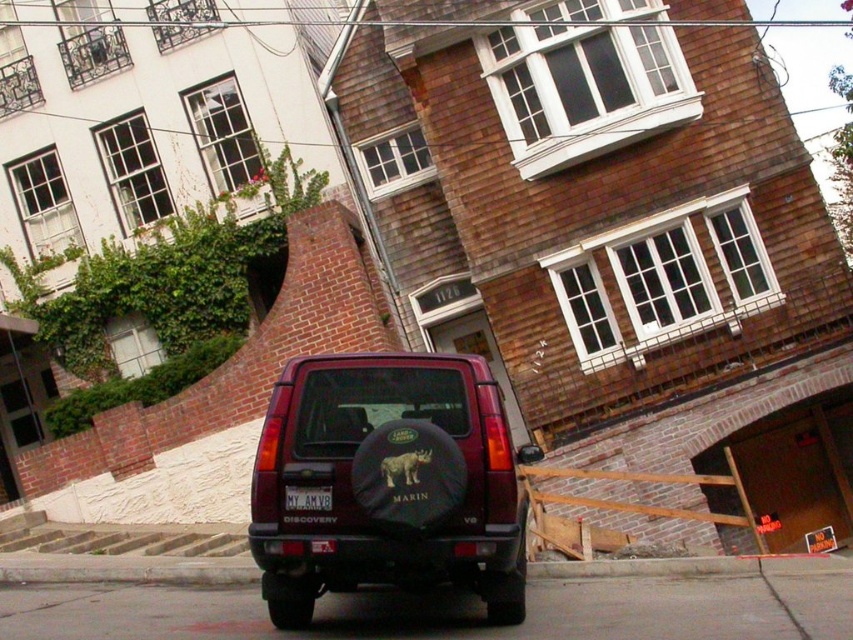
You are standing in front of the Land Rover Discovery SUV. There are two points marked on the vehicle. One is at point coordinates point (0, 577) and the other is at point (294, 486). Which point is closer to you?

Point (294, 486) is closer to you because it is less further away than point (0, 577).